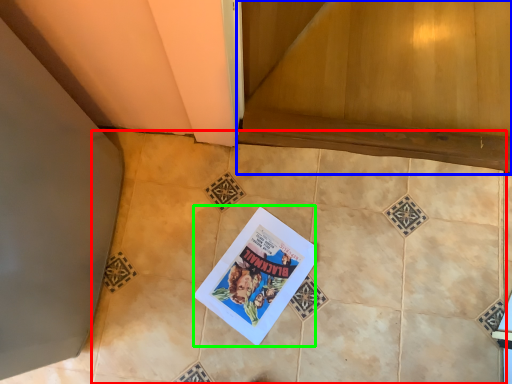
Question: Estimate the real-world distances between objects in this image. Which object is closer to ceramic tile (highlighted by a red box), stairwell (highlighted by a blue box) or comic book (highlighted by a green box)?

Choices:
 (A) stairwell
 (B) comic book

Answer: (B)